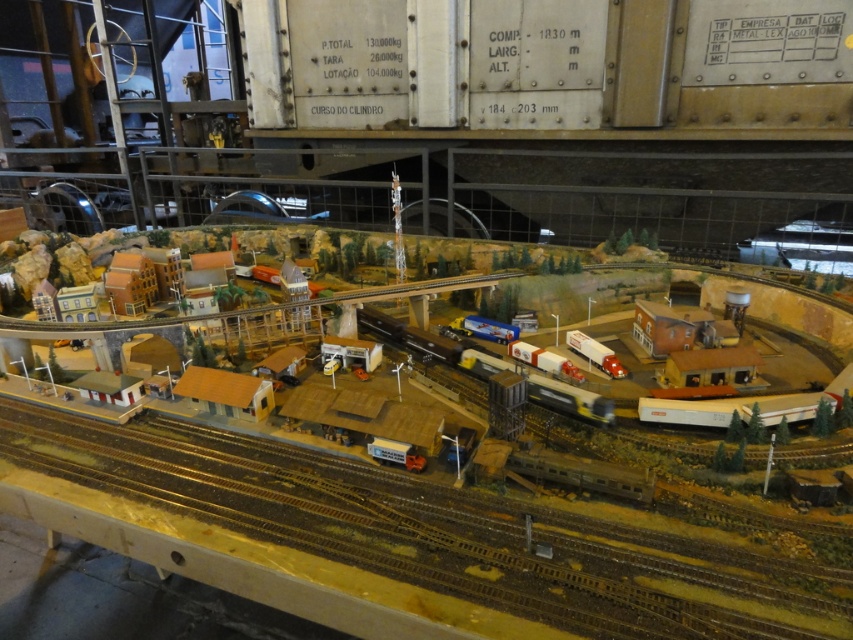
Question: Which object appears farthest from the camera in this image?

Choices:
 (A) orange matte train car at center
 (B) brown wooden train track at center
 (C) metallic silver train at center

Answer: (C)

Question: Among these objects, which one is nearest to the camera?

Choices:
 (A) brown wooden train track at center
 (B) metallic silver train at center

Answer: (A)

Question: Can you confirm if metallic silver train at center is positioned above orange matte train car at center?

Choices:
 (A) no
 (B) yes

Answer: (B)

Question: Is brown wooden train track at center to the right of metallic silver train at center from the viewer's perspective?

Choices:
 (A) yes
 (B) no

Answer: (B)

Question: Where is metallic silver train at center located in relation to orange matte train car at center in the image?

Choices:
 (A) above
 (B) below

Answer: (A)

Question: Which point appears closest to the camera in this image?

Choices:
 (A) (709, 422)
 (B) (677, 596)

Answer: (B)